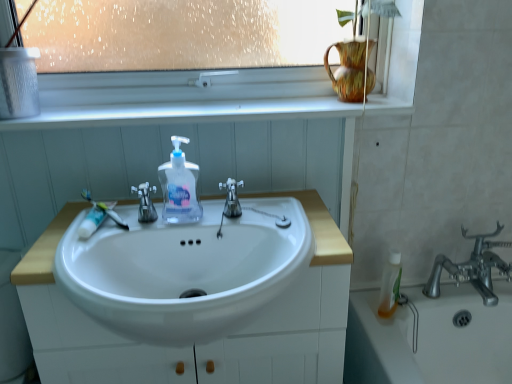
Question: Should I look upward or downward to see white matte toothpaste at left?

Choices:
 (A) up
 (B) down

Answer: (B)

Question: From a real-world perspective, is white plastic toothbrush at left beneath white matte toothpaste at left?

Choices:
 (A) yes
 (B) no

Answer: (B)

Question: Is white plastic toothbrush at left thinner than white matte toothpaste at left?

Choices:
 (A) no
 (B) yes

Answer: (A)

Question: Is white plastic toothbrush at left further to the viewer compared to white matte toothpaste at left?

Choices:
 (A) yes
 (B) no

Answer: (A)

Question: From a real-world perspective, is white plastic toothbrush at left located higher than white matte toothpaste at left?

Choices:
 (A) no
 (B) yes

Answer: (B)

Question: Does white plastic toothbrush at left have a larger size compared to white matte toothpaste at left?

Choices:
 (A) yes
 (B) no

Answer: (B)

Question: From the image's perspective, is white plastic toothbrush at left located above white matte toothpaste at left?

Choices:
 (A) no
 (B) yes

Answer: (B)

Question: Is the position of white glossy cabinet at center more distant than that of satin nickel faucet at center, acting as the first tap starting from the left?

Choices:
 (A) yes
 (B) no

Answer: (B)

Question: Is white glossy cabinet at center positioned in front of satin nickel faucet at center, arranged as the second tap when viewed from the right?

Choices:
 (A) yes
 (B) no

Answer: (A)

Question: Is white glossy cabinet at center beside satin nickel faucet at center, arranged as the second tap when viewed from the right?

Choices:
 (A) no
 (B) yes

Answer: (A)

Question: Does white glossy cabinet at center have a larger size compared to satin nickel faucet at center, acting as the first tap starting from the left?

Choices:
 (A) no
 (B) yes

Answer: (B)

Question: Is white glossy cabinet at center positioned far away from satin nickel faucet at center, arranged as the second tap when viewed from the right?

Choices:
 (A) no
 (B) yes

Answer: (A)

Question: Does white glossy cabinet at center have a smaller size compared to satin nickel faucet at center, acting as the first tap starting from the left?

Choices:
 (A) no
 (B) yes

Answer: (A)

Question: Is translucent plastic mouthwash at lower right to the left of satin nickel faucet at center, arranged as the second tap when viewed from the right, from the viewer's perspective?

Choices:
 (A) yes
 (B) no

Answer: (B)